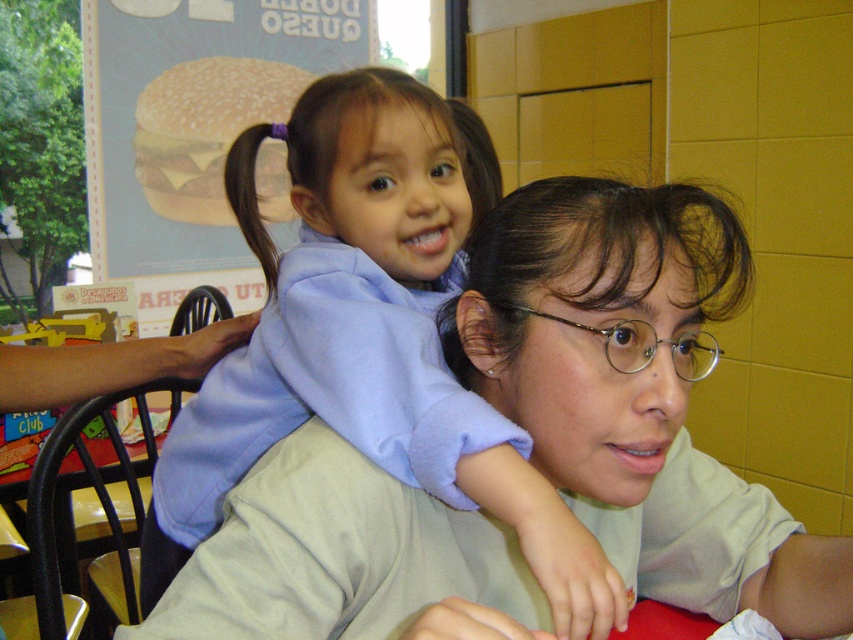
Question: Does light blue fleece at center have a lesser width compared to dark brown silky hair at upper center?

Choices:
 (A) yes
 (B) no

Answer: (B)

Question: Is light blue fleece at center to the right of dark brown silky hair at upper center from the viewer's perspective?

Choices:
 (A) yes
 (B) no

Answer: (A)

Question: Which of the following is the closest to the observer?

Choices:
 (A) metallic round glasses at center
 (B) light blue fleece at center
 (C) dark brown silky hair at upper center

Answer: (B)

Question: Among these objects, which one is nearest to the camera?

Choices:
 (A) metallic round glasses at center
 (B) light blue fleece at center
 (C) dark brown silky hair at upper center

Answer: (B)

Question: Which point appears farthest from the camera in this image?

Choices:
 (A) (431, 428)
 (B) (509, 308)
 (C) (258, 209)

Answer: (C)

Question: Can you confirm if light blue fleece at center is smaller than metallic round glasses at center?

Choices:
 (A) yes
 (B) no

Answer: (B)